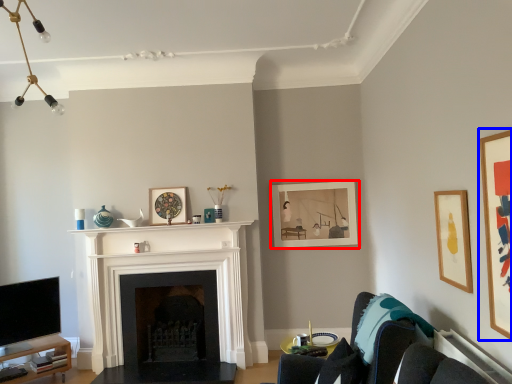
Question: Among these objects, which one is farthest to the camera, picture frame (highlighted by a red box) or picture frame (highlighted by a blue box)?

Choices:
 (A) picture frame
 (B) picture frame

Answer: (A)